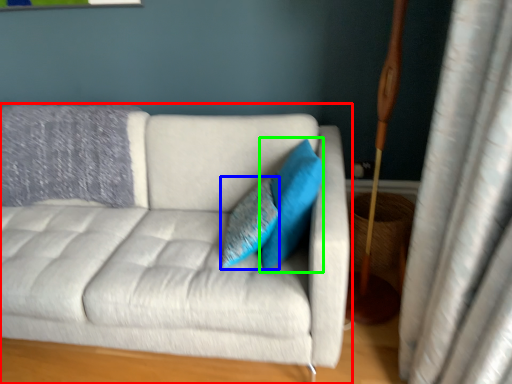
Question: Which is farther away from studio couch (highlighted by a red box)? pillow (highlighted by a blue box) or pillow (highlighted by a green box)?

Choices:
 (A) pillow
 (B) pillow

Answer: (B)